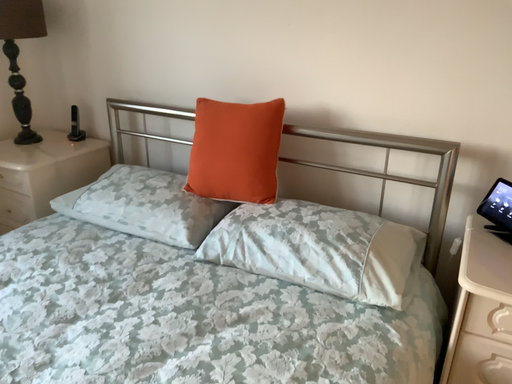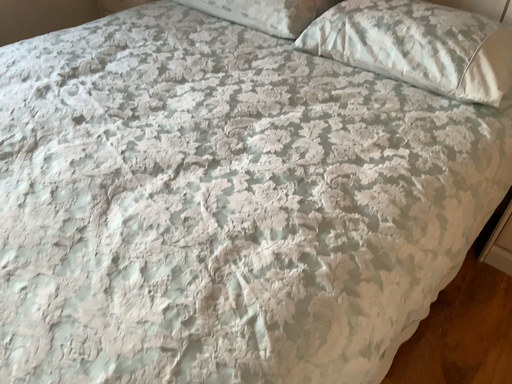
Question: Which way did the camera rotate in the video?

Choices:
 (A) rotated left
 (B) rotated right

Answer: (A)